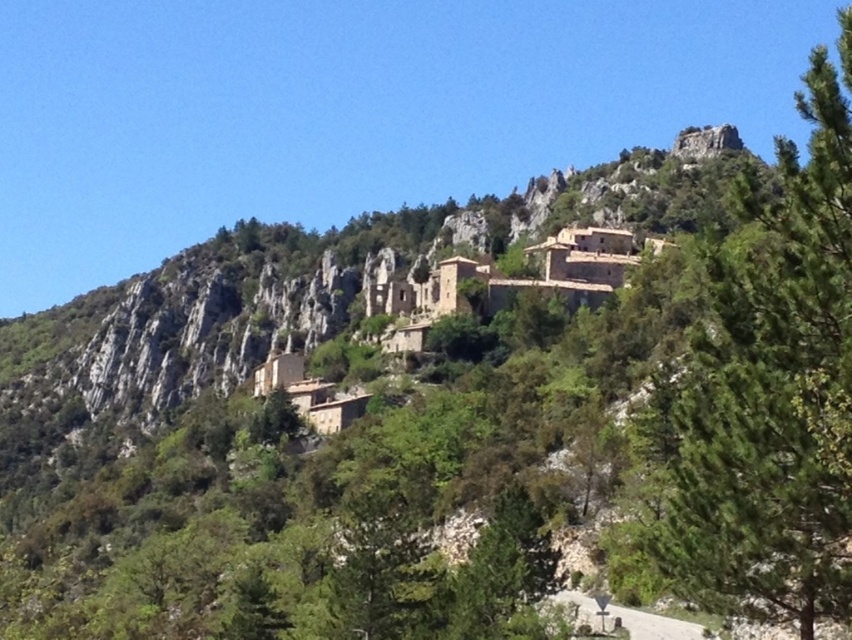
You are planning to install a wireless sensor between the green leafy tree at upper right and the brown stone buildings at center. The sensor has a maximum range of 150 feet. Will it be able to connect both points?

The distance between the green leafy tree at upper right and the brown stone buildings at center is 149.97 feet, which is within the sensor range of 150 feet. The sensor will successfully connect both points.

You are standing at the center of the image and want to locate the green leafy tree at upper right. According to the coordinates provided, in which direction should you look to find it?

The green leafy tree at upper right is located at coordinates point (770,388), so you should look towards the upper right direction to find it.